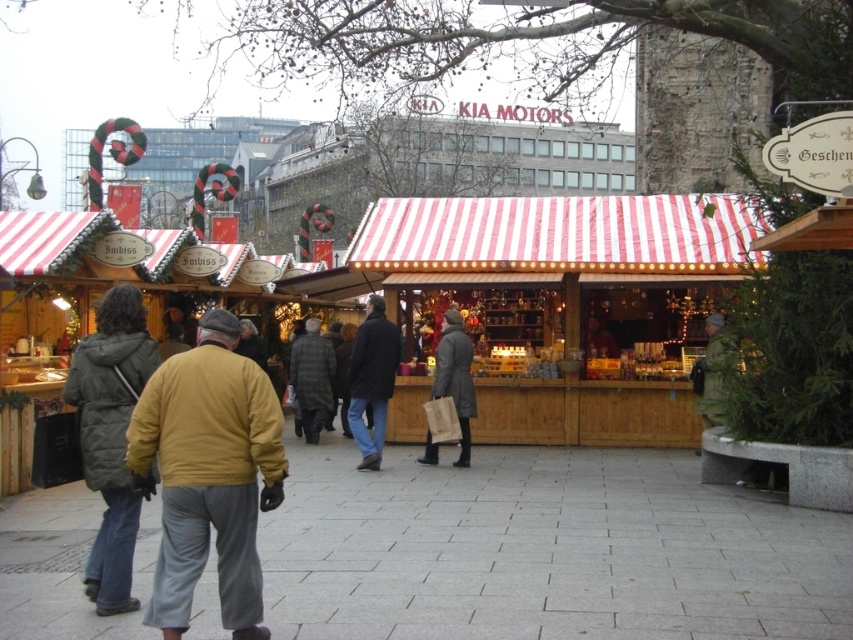
You are a photographer at the Christmas market and want to capture both the yellow fabric jacket at center and the matte gray jacket at center in a single photo. Which jacket should you focus on first to ensure both are in frame?

The yellow fabric jacket at center is positioned under the matte gray jacket at center, so you should focus on the matte gray jacket at center first to ensure both are in frame.

You are a photographer at the Christmas market and want to capture both the yellow fabric jacket at center and the matte gray jacket at center in a single frame. Since you want both jackets to appear equally prominent, which jacket should you move closer to the camera?

The yellow fabric jacket at center is larger in size than the matte gray jacket at center. To make them appear equally prominent, you should move the matte gray jacket at center closer to the camera so that its size in the frame matches the larger yellow fabric jacket at center.